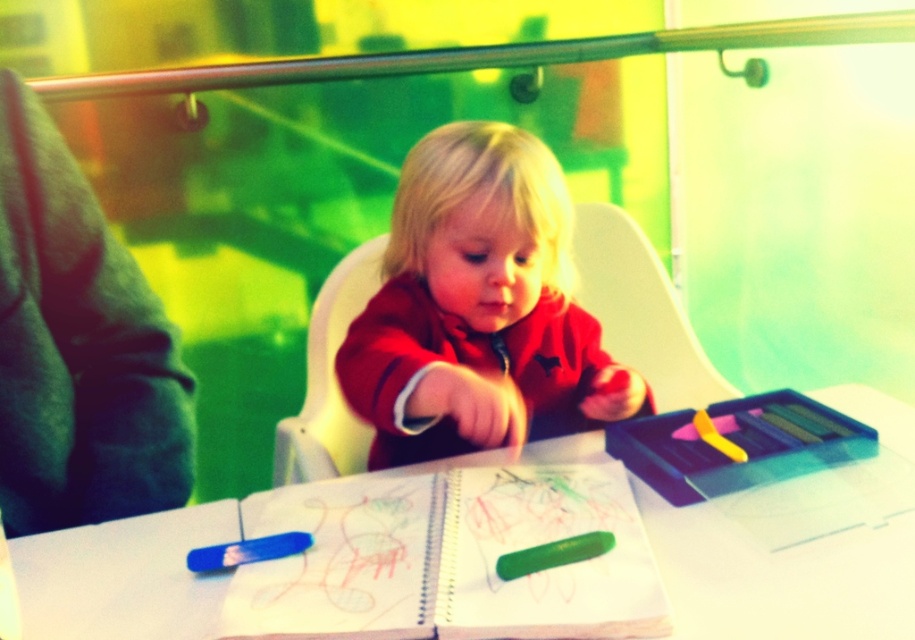
You are a parent observing your child at a table. You notice the matte red sweater at center and the green matte notebook at center. Which object takes up more horizontal space on the table?

The matte red sweater at center is wider than the green matte notebook at center, so it takes up more horizontal space on the table.

You are a parent trying to help your child organize their crayons. You see two points on the table where crayons might be placed. Which point is closer to you, point (485, 244) or point (482, 509)?

Point (485, 244) is further to the viewer than point (482, 509), so the closer point to you is point (482, 509).